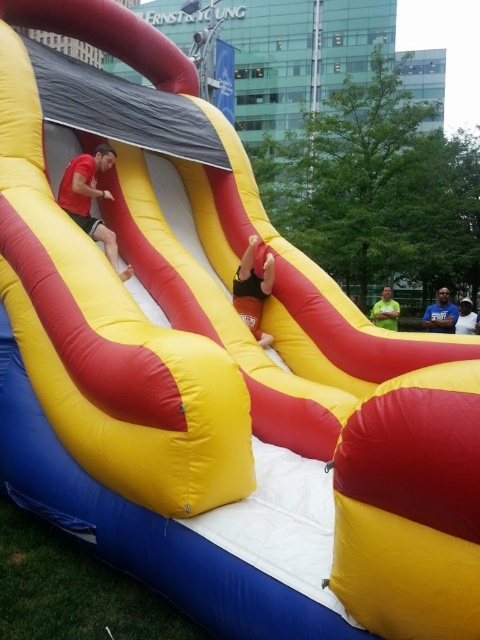
You are standing at the base of the slide and looking up. You see two points marked on the slide. Which point is closer to you, point at coordinate (x=434, y=308) or point at coordinate (x=467, y=307)?

Point at coordinate (x=434, y=308) is closer to you because it is in front of point at coordinate (x=467, y=307).

You are a photographer trying to capture a candid shot of the smooth pink foot at center and the white cotton shirt at center. Since you want to focus on the foot, which object should you zoom in on more, considering their sizes?

The smooth pink foot at center is larger in width than the white cotton shirt at center, so you should zoom in more on the smooth pink foot at center to focus on it.

You are a photographer trying to capture a photo of both the green matte shirt at lower right and the white cotton shirt at center. Since you want to ensure both are visible in the frame, which shirt should you focus on first to account for their sizes?

The green matte shirt at lower right is taller than the white cotton shirt at center, so you should focus on the green matte shirt at lower right first to ensure it fits within the frame due to its larger size.